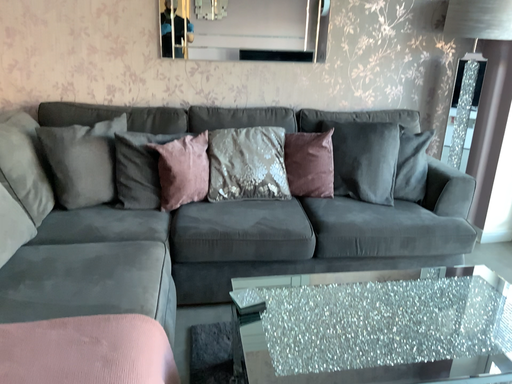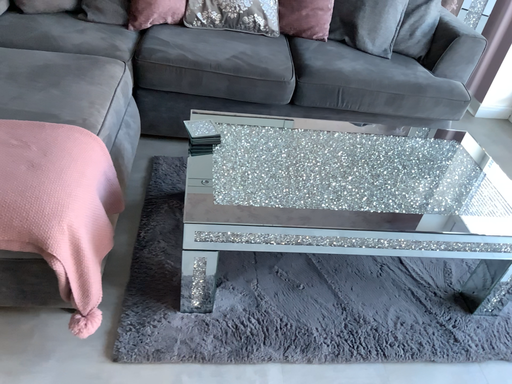
Question: How did the camera likely rotate when shooting the video?

Choices:
 (A) rotated downward
 (B) rotated upward

Answer: (A)